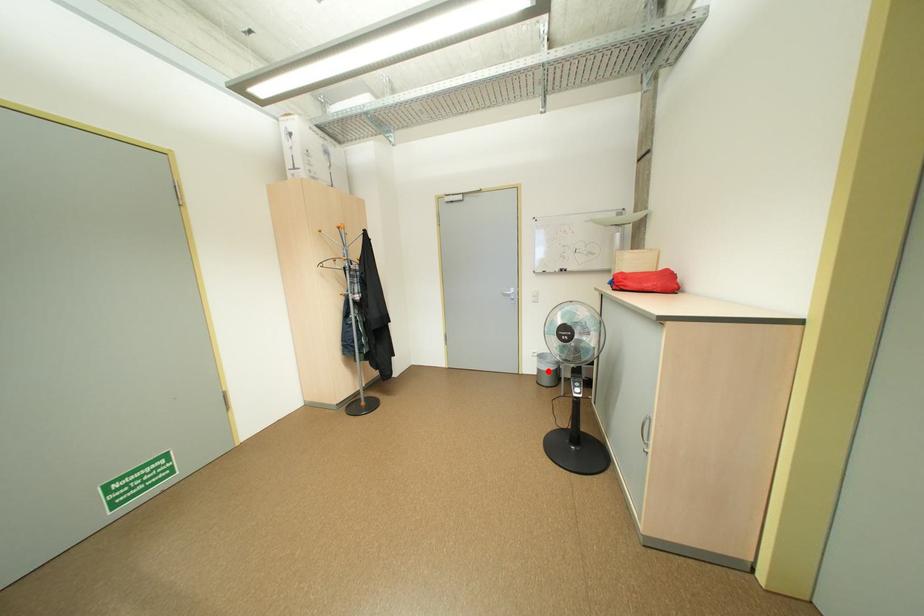
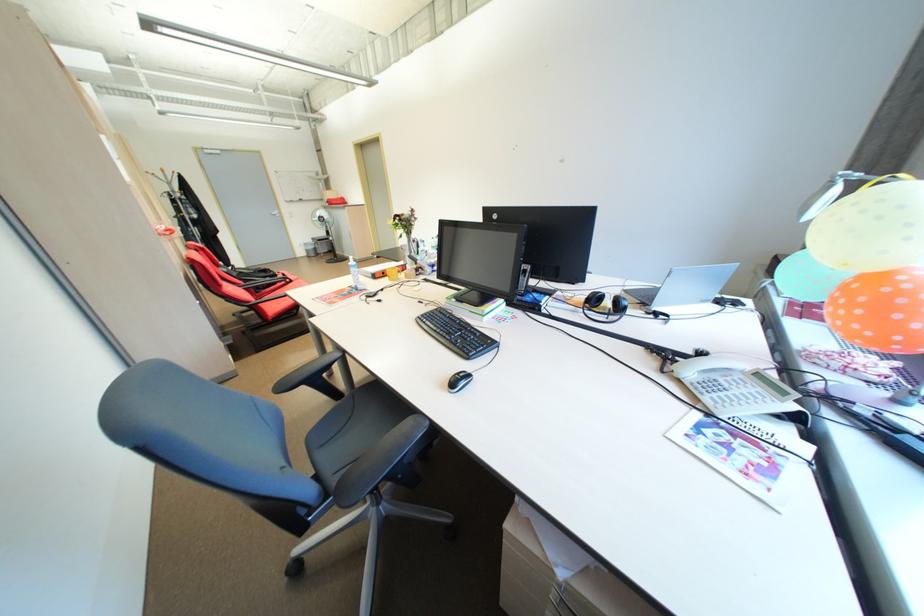
Question: I am providing you with two images of the same scene from different viewpoints. A red point is shown in image1. For the corresponding object point in image2, is it positioned nearer or farther from the camera?

Choices:
 (A) Nearer
 (B) Farther

Answer: (A)